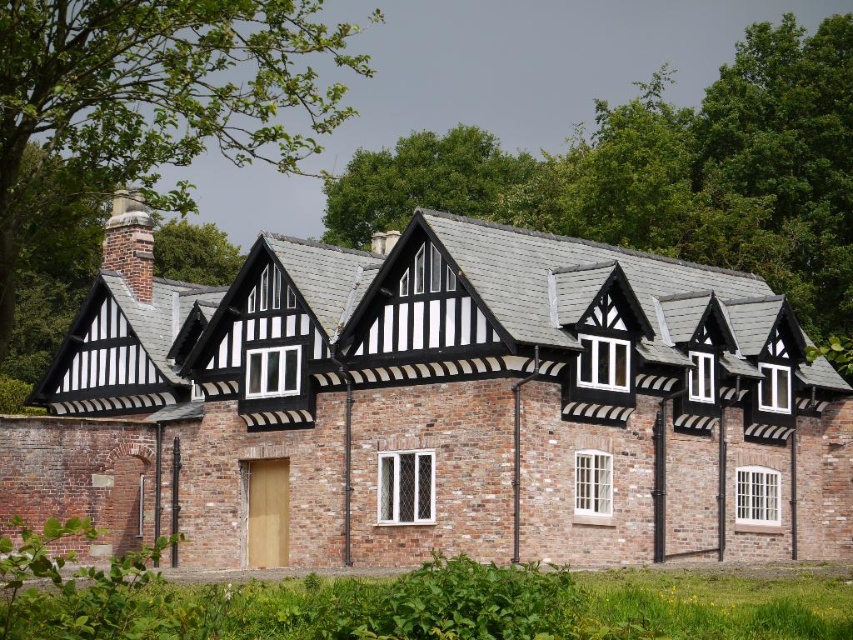
Question: Which point appears closest to the camera in this image?

Choices:
 (A) (131, 236)
 (B) (614, 508)

Answer: (B)

Question: Is black timber trim at center wider than brick chimney at upper left?

Choices:
 (A) yes
 (B) no

Answer: (A)

Question: Can you confirm if black timber trim at center is positioned above brick chimney at upper left?

Choices:
 (A) yes
 (B) no

Answer: (B)

Question: Can you confirm if black timber trim at center is positioned above brick chimney at upper left?

Choices:
 (A) no
 (B) yes

Answer: (A)